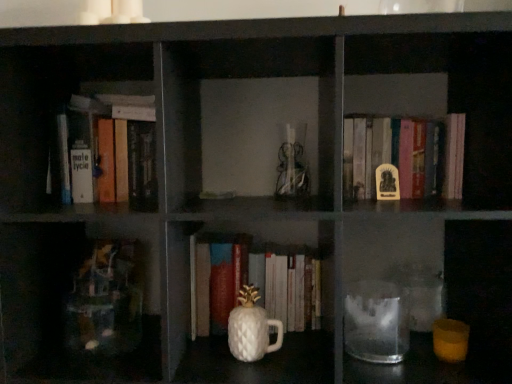
Question: Considering the relative sizes of white glossy pineapple-shaped cup at center and hardcover book at upper left, arranged as the second book when viewed from the right, in the image provided, is white glossy pineapple-shaped cup at center smaller than hardcover book at upper left, arranged as the second book when viewed from the right,?

Choices:
 (A) yes
 (B) no

Answer: (A)

Question: Could you tell me if white glossy pineapple-shaped cup at center is turned towards hardcover book at upper left, arranged as the second book when viewed from the right?

Choices:
 (A) no
 (B) yes

Answer: (A)

Question: Is white glossy pineapple-shaped cup at center located outside hardcover book at upper left, which is the first book in left-to-right order?

Choices:
 (A) no
 (B) yes

Answer: (B)

Question: Can you confirm if white glossy pineapple-shaped cup at center is wider than hardcover book at upper left, which is the first book in left-to-right order?

Choices:
 (A) yes
 (B) no

Answer: (B)

Question: Is white glossy pineapple-shaped cup at center to the right of hardcover book at upper left, arranged as the second book when viewed from the right, from the viewer's perspective?

Choices:
 (A) no
 (B) yes

Answer: (B)

Question: Is yellow matte statue at center, the second book viewed from the left, taller or shorter than white glossy pineapple-shaped cup at center?

Choices:
 (A) tall
 (B) short

Answer: (A)

Question: Considering the positions of point (401, 173) and point (263, 339), is point (401, 173) closer or farther from the camera than point (263, 339)?

Choices:
 (A) farther
 (B) closer

Answer: (A)

Question: Which is correct: yellow matte statue at center, the second book viewed from the left, is inside white glossy pineapple-shaped cup at center, or outside of it?

Choices:
 (A) inside
 (B) outside

Answer: (B)

Question: Would you say yellow matte statue at center, the second book viewed from the left, is to the left or to the right of white glossy pineapple-shaped cup at center in the picture?

Choices:
 (A) right
 (B) left

Answer: (A)

Question: Relative to transparent glass jar at lower center, is white glossy pineapple-shaped cup at center in front or behind?

Choices:
 (A) front
 (B) behind

Answer: (B)

Question: In terms of size, does white glossy pineapple-shaped cup at center appear bigger or smaller than transparent glass jar at lower center?

Choices:
 (A) small
 (B) big

Answer: (A)

Question: From the image's perspective, is white glossy pineapple-shaped cup at center above or below transparent glass jar at lower center?

Choices:
 (A) below
 (B) above

Answer: (A)

Question: Considering the positions of white glossy pineapple-shaped cup at center and transparent glass jar at lower center in the image, is white glossy pineapple-shaped cup at center taller or shorter than transparent glass jar at lower center?

Choices:
 (A) short
 (B) tall

Answer: (B)

Question: Is hardcover book at upper left, arranged as the second book when viewed from the right, to the left or to the right of transparent glass jar at lower center in the image?

Choices:
 (A) left
 (B) right

Answer: (A)

Question: From a real-world perspective, is hardcover book at upper left, which is the first book in left-to-right order, positioned above or below transparent glass jar at lower center?

Choices:
 (A) above
 (B) below

Answer: (A)